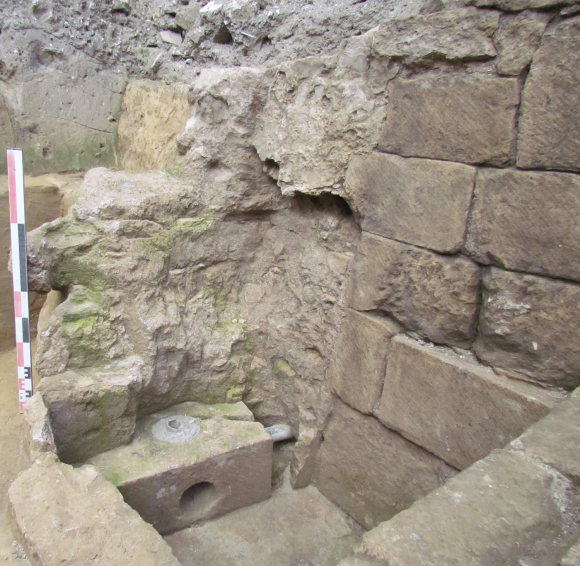
Identify the location of wall. (432, 538).